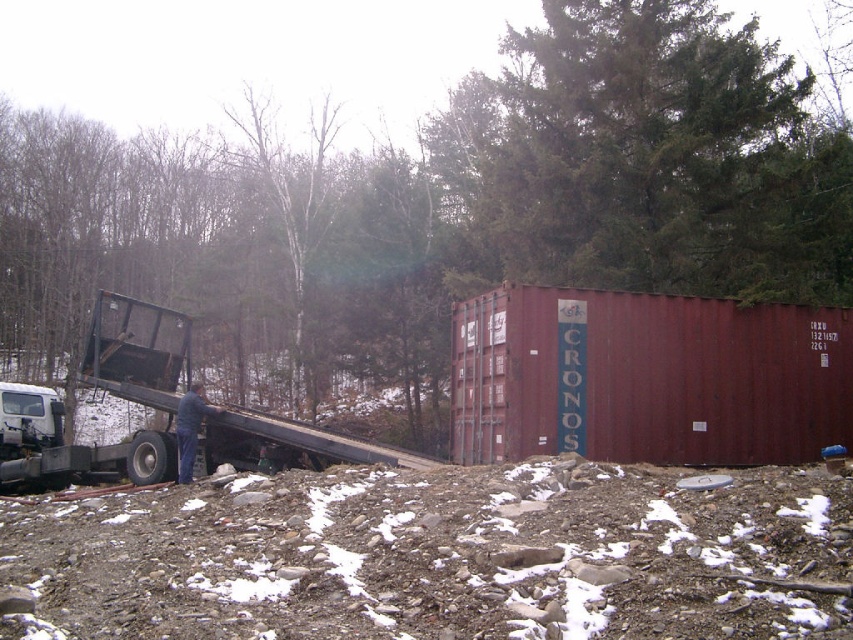
Question: Which of these objects is positioned closest to the metallic truck bed at center?

Choices:
 (A) maroon metal shipping container at right
 (B) metallic flatbed truck at left

Answer: (B)

Question: Estimate the real-world distances between objects in this image. Which object is farther from the metallic truck bed at center?

Choices:
 (A) maroon metal shipping container at right
 (B) metallic flatbed truck at left

Answer: (A)

Question: Which point is farther to the camera?

Choices:
 (A) (38, 390)
 (B) (839, 320)

Answer: (A)

Question: Can you confirm if maroon metal shipping container at right is positioned above metallic flatbed truck at left?

Choices:
 (A) no
 (B) yes

Answer: (B)

Question: Does metallic truck bed at center appear over maroon metal shipping container at right?

Choices:
 (A) no
 (B) yes

Answer: (A)

Question: Does maroon metal shipping container at right have a larger size compared to metallic flatbed truck at left?

Choices:
 (A) no
 (B) yes

Answer: (A)